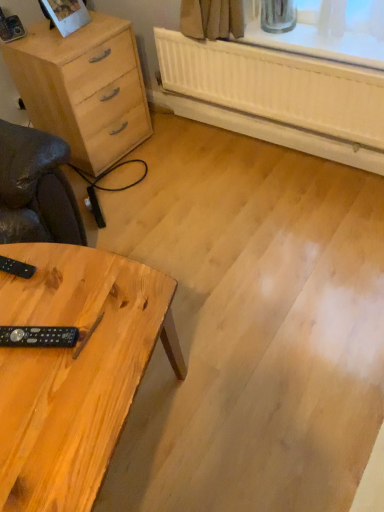
Question: From a real-world perspective, is black plastic remote at lower left, acting as the 1th control starting from the top, beneath natural wood chest of drawers at left?

Choices:
 (A) yes
 (B) no

Answer: (B)

Question: Is black plastic remote at lower left, acting as the 1th control starting from the top, smaller than natural wood chest of drawers at left?

Choices:
 (A) yes
 (B) no

Answer: (A)

Question: Considering the relative sizes of black plastic remote at lower left, the first control in the back-to-front sequence, and natural wood chest of drawers at left in the image provided, is black plastic remote at lower left, the first control in the back-to-front sequence, shorter than natural wood chest of drawers at left?

Choices:
 (A) no
 (B) yes

Answer: (B)

Question: Is black plastic remote at lower left, acting as the 1th control starting from the top, taller than natural wood chest of drawers at left?

Choices:
 (A) no
 (B) yes

Answer: (A)

Question: Considering the relative positions of black plastic remote at lower left, marked as the 2th control in a front-to-back arrangement, and natural wood chest of drawers at left in the image provided, is black plastic remote at lower left, marked as the 2th control in a front-to-back arrangement, behind natural wood chest of drawers at left?

Choices:
 (A) yes
 (B) no

Answer: (B)

Question: Does black plastic remote at lower left, marked as the 2th control in a front-to-back arrangement, have a greater width compared to natural wood chest of drawers at left?

Choices:
 (A) no
 (B) yes

Answer: (A)

Question: Is natural wood table at lower left thinner than black plastic remote at lower left, the first control in the back-to-front sequence?

Choices:
 (A) yes
 (B) no

Answer: (B)

Question: Is natural wood table at lower left smaller than black plastic remote at lower left, which is the 2th control from bottom to top?

Choices:
 (A) yes
 (B) no

Answer: (B)

Question: From the image's perspective, is natural wood table at lower left beneath black plastic remote at lower left, the first control in the back-to-front sequence?

Choices:
 (A) yes
 (B) no

Answer: (A)

Question: Is natural wood table at lower left positioned behind black plastic remote at lower left, which is the 2th control from bottom to top?

Choices:
 (A) no
 (B) yes

Answer: (A)

Question: Does natural wood table at lower left contain black plastic remote at lower left, the first control in the back-to-front sequence?

Choices:
 (A) no
 (B) yes

Answer: (B)

Question: Considering the relative sizes of natural wood table at lower left and black plastic remote at lower left, marked as the 2th control in a front-to-back arrangement, in the image provided, is natural wood table at lower left wider than black plastic remote at lower left, marked as the 2th control in a front-to-back arrangement,?

Choices:
 (A) yes
 (B) no

Answer: (A)

Question: Is natural wood chest of drawers at left in front of natural wood table at lower left?

Choices:
 (A) yes
 (B) no

Answer: (B)